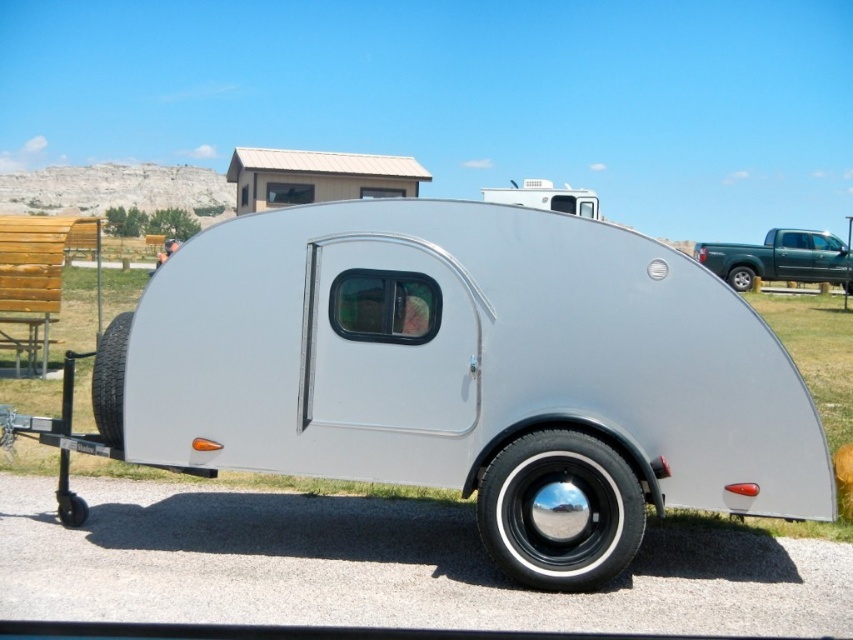
Which of these two, shiny chrome wheel at lower center or green matte truck at right, stands shorter?

Standing shorter between the two is shiny chrome wheel at lower center.

Measure the distance between shiny chrome wheel at lower center and camera.

16.80 feet

Locate an element on the screen. This screenshot has width=853, height=640. shiny chrome wheel at lower center is located at coordinates (560, 512).

Between shiny chrome wheel at lower center and black rubber wheel at lower left, which one appears on the right side from the viewer's perspective?

Positioned to the right is shiny chrome wheel at lower center.

Is shiny chrome wheel at lower center wider than black rubber wheel at lower left?

Yes, shiny chrome wheel at lower center is wider than black rubber wheel at lower left.

Is point (572, 508) positioned before point (79, 506)?

Yes, it is in front of point (79, 506).

The width and height of the screenshot is (853, 640). What are the coordinates of `shiny chrome wheel at lower center` in the screenshot? It's located at (560, 512).

Who is higher up, black rubber tire at lower left or silver metallic wheel at lower right?

silver metallic wheel at lower right is higher up.

Does black rubber tire at lower left appear on the left side of silver metallic wheel at lower right?

Yes, black rubber tire at lower left is to the left of silver metallic wheel at lower right.

Is point (100, 392) less distant than point (735, 266)?

Yes, point (100, 392) is in front of point (735, 266).

Where is `black rubber tire at lower left`? black rubber tire at lower left is located at coordinates (109, 380).